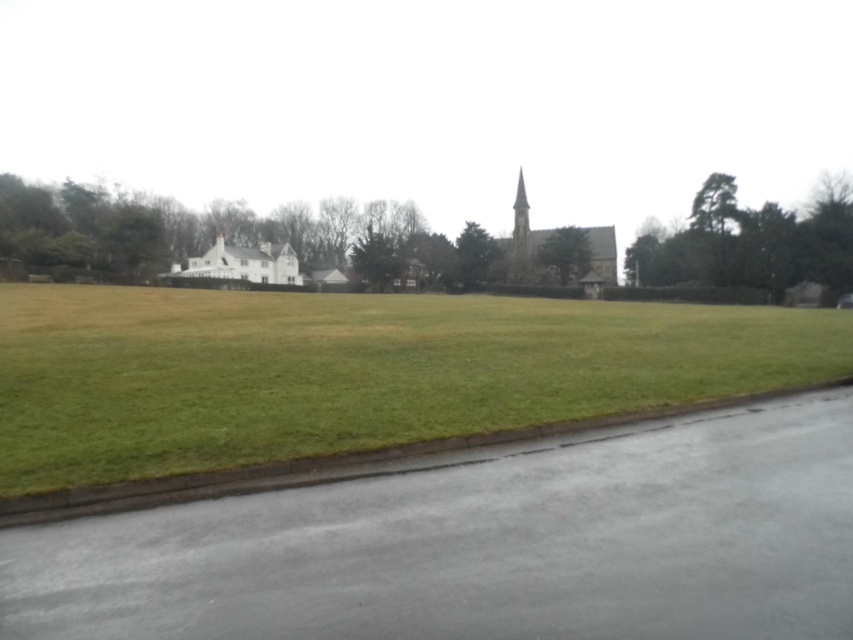
You are standing at the origin point in the suburban scene. You see two points marked as point 1 at coordinates (291, 269) and point 2 at coordinates (521, 204). Which point is closer to you?

Point 1 at coordinates (291, 269) is closer to you because it is in front of point 2 at coordinates (521, 204).

What are the coordinates of the white matte house at center?

The coordinates of the white matte house at center are (242, 262).

You are standing at the origin point of the image. A drone is flying towards the green grass at center. What are the coordinates where the drone will land?

The drone will land at the coordinates point of green grass at center which is at point (x=352, y=371).